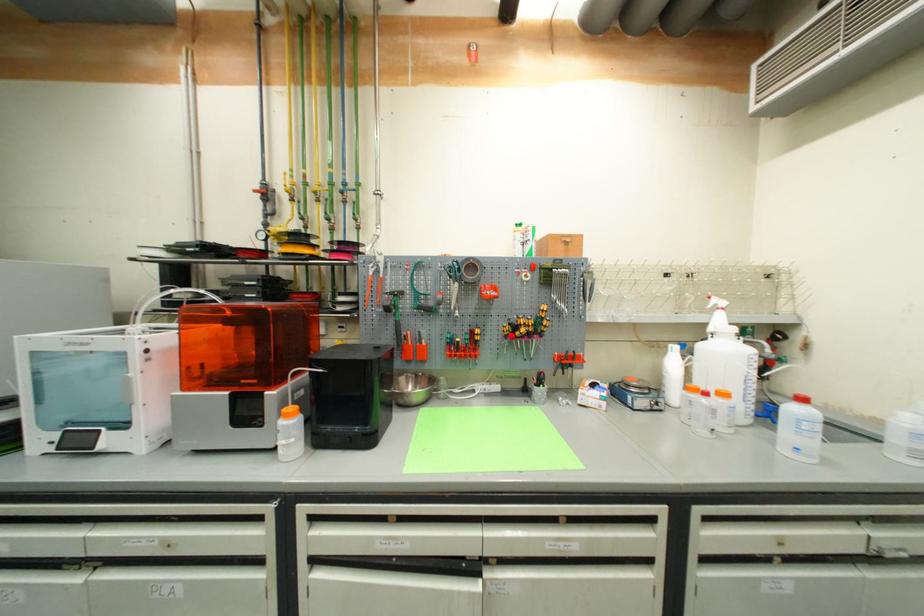
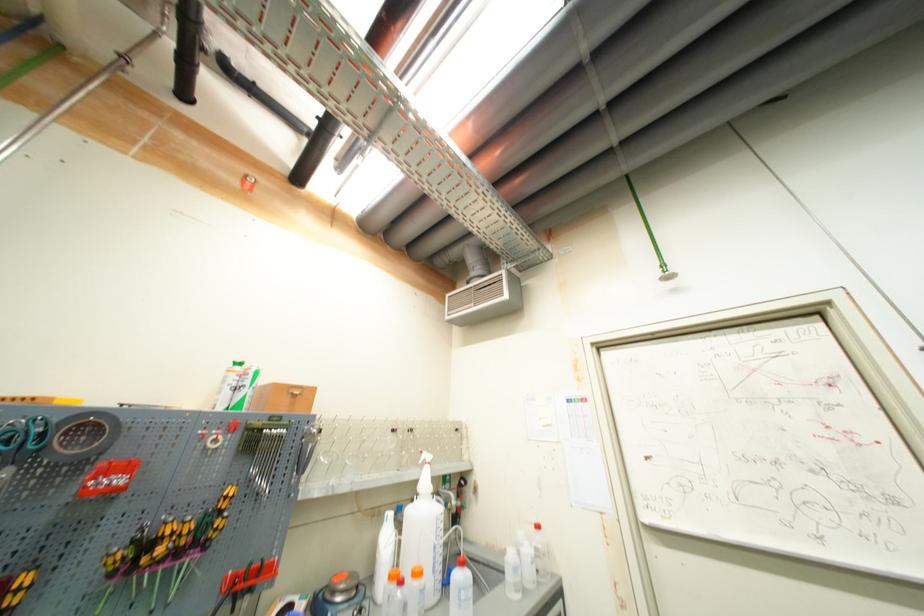
The point at the highlighted location is marked in the first image. Where is the corresponding point in the second image?

(116, 570)